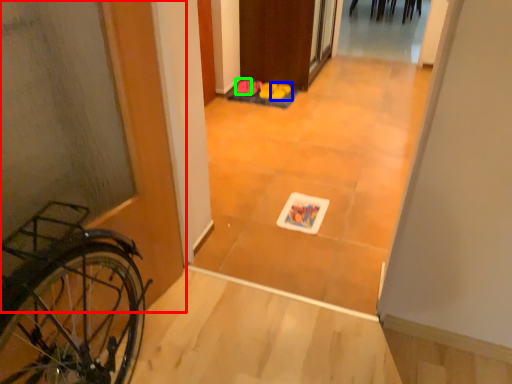
Question: Considering the real-world distances, which object is farthest from door (highlighted by a red box)? footwear (highlighted by a blue box) or footwear (highlighted by a green box)?

Choices:
 (A) footwear
 (B) footwear

Answer: (B)